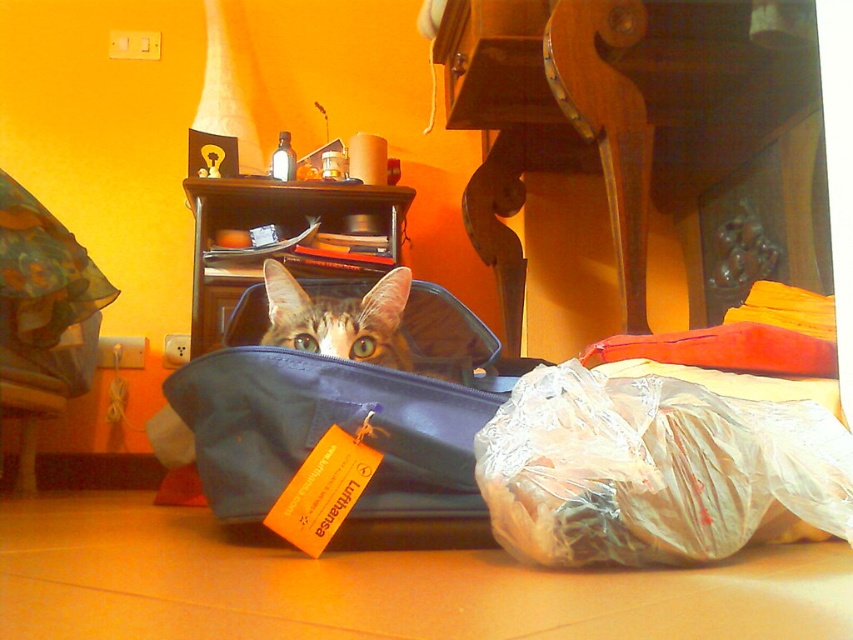
Question: Among these objects, which one is farthest from the camera?

Choices:
 (A) tabby fur cat at center
 (B) blue fabric bag at center

Answer: (A)

Question: Which point is farther to the camera?

Choices:
 (A) (561, 433)
 (B) (289, 394)
 (C) (346, 356)

Answer: (C)

Question: Is transparent plastic bag at center above blue fabric bag at center?

Choices:
 (A) no
 (B) yes

Answer: (A)

Question: Which of these objects is positioned closest to the transparent plastic bag at center?

Choices:
 (A) tabby fur cat at center
 (B) blue fabric bag at center

Answer: (B)

Question: Is transparent plastic bag at center smaller than tabby fur cat at center?

Choices:
 (A) yes
 (B) no

Answer: (B)

Question: Does blue fabric bag at center have a larger size compared to tabby fur cat at center?

Choices:
 (A) no
 (B) yes

Answer: (B)